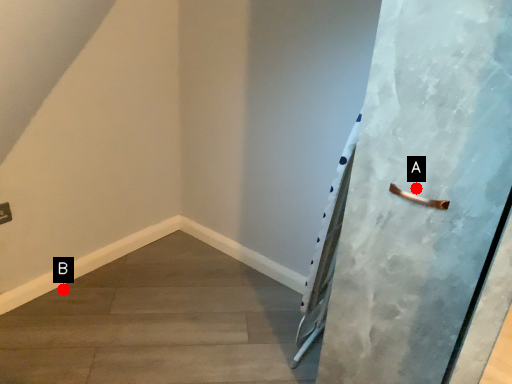
Question: Two points are circled on the image, labeled by A and B beside each circle. Which point is further to the camera?

Choices:
 (A) A is further
 (B) B is further

Answer: (B)